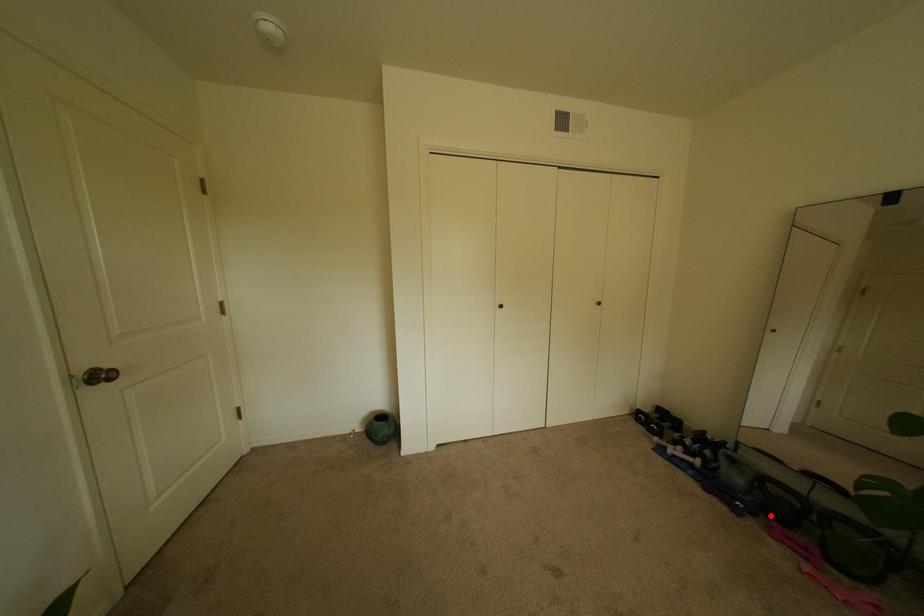
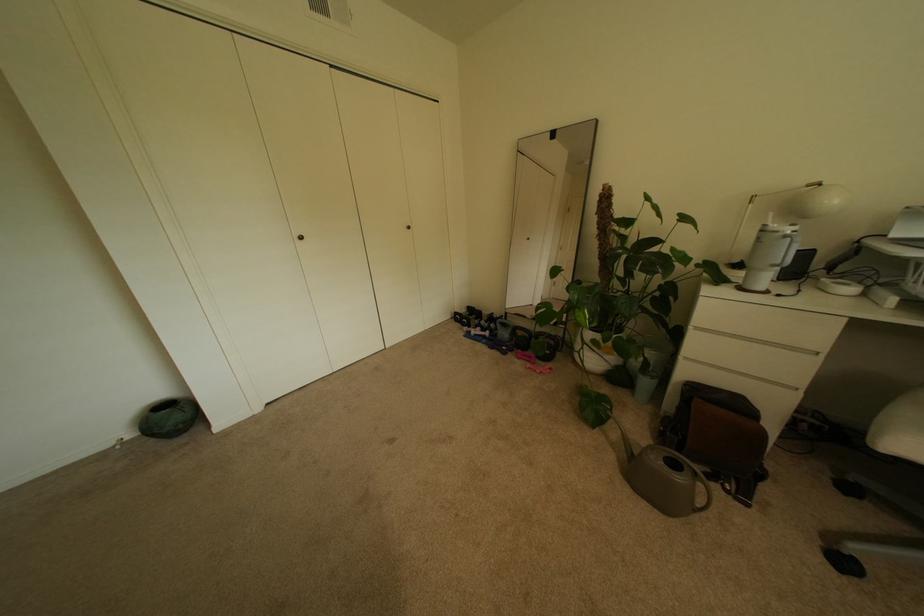
Question: I am providing you with two images of the same scene from different viewpoints. A red point is shown in image1. For the corresponding object point in image2, is it positioned nearer or farther from the camera?

Choices:
 (A) Nearer
 (B) Farther

Answer: (B)